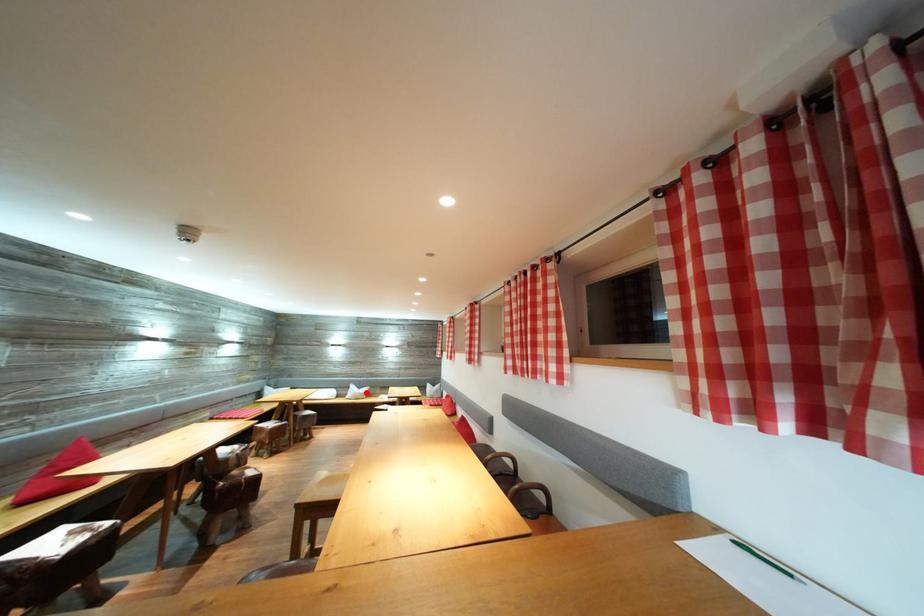
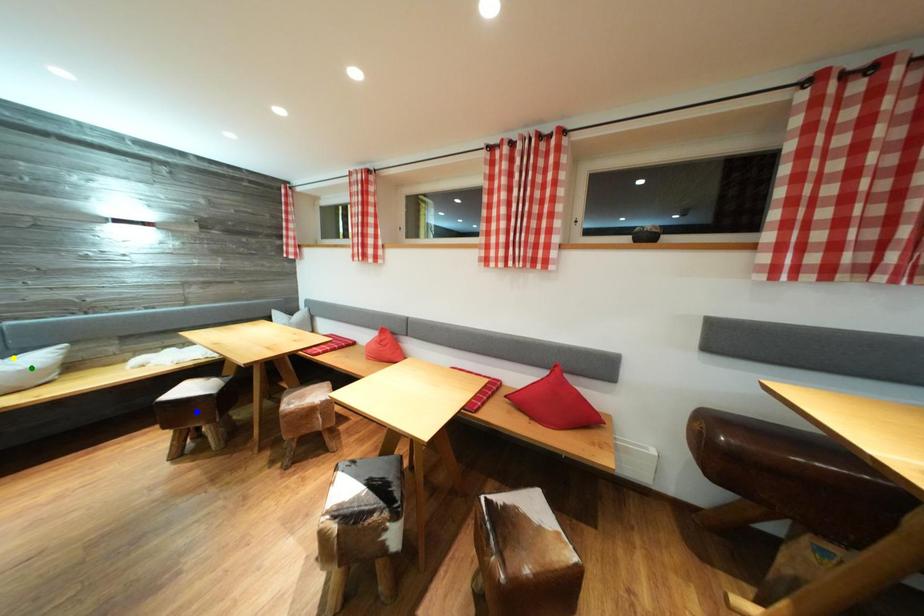
Question: I am providing you with two images of the same scene from different viewpoints. A red point is marked on the first image. You are given multiple points on the second image. Can you choose the point in image 2 that corresponds to the point in image 1?

Choices:
 (A) green point
 (B) yellow point
 (C) blue point

Answer: (B)